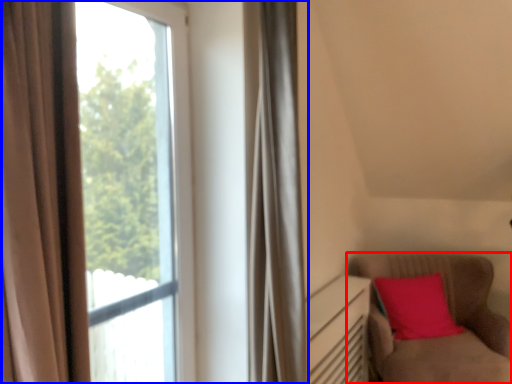
Question: Among these objects, which one is farthest to the camera, furniture (highlighted by a red box) or window (highlighted by a blue box)?

Choices:
 (A) furniture
 (B) window

Answer: (A)